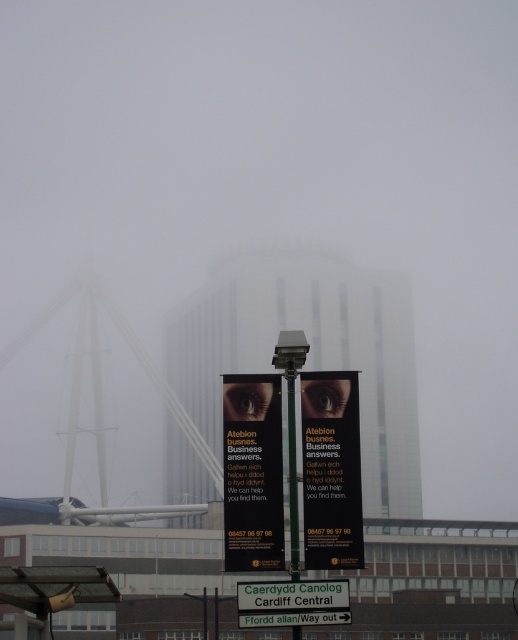
You are a delivery person trying to locate the business office mentioned on the banners. The office is at the point marked by the black matte banner at center. What are the coordinates of the banner?

The coordinates of the black matte banner at center are (252, 472).

You are a tourist in a foggy city and see both the black matte sign at center and the white plastic street sign at center. Which one is positioned to the right side?

The black matte sign at center is positioned to the right of the white plastic street sign at center.

You are a delivery person trying to locate the entrance of the building. The address you have matches the text on the black matte banner at center. Where should you look to find the entrance based on the banner location?

The entrance is likely located near the black matte banner at center, which is positioned at coordinates (252,472) in the image. Since banners are often placed near entrances to advertise services, the entrance should be nearby.